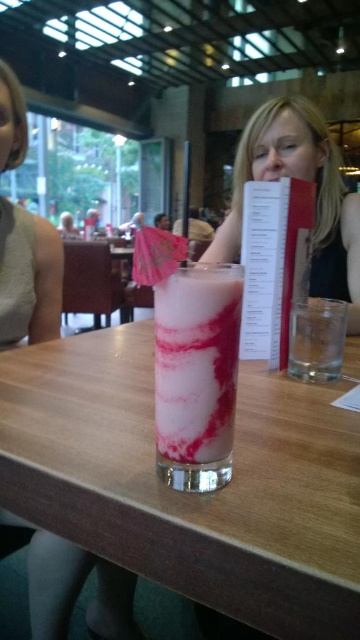
You are a fashion designer observing the dining scene. You notice the matte white dress at center and the smooth black hair at upper center. Which of these two items has a shorter vertical dimension?

The matte white dress at center has a lesser height compared to the smooth black hair at upper center, so the matte white dress at center is shorter vertically.

You are a customer sitting at the table and want to order a drink. You notice the white paper menu at center and the clear glass at right. Which object is closer to your left side?

The white paper menu at center is to the left of the clear glass at right, so it is closer to your left side.